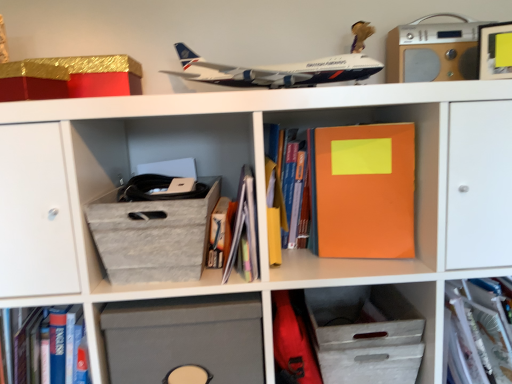
Question: From the image's perspective, relative to matte paper book at center, placed as the 2th book when sorted from left to right, is hardcover book at center, which is the 1th book from left to right, above or below?

Choices:
 (A) above
 (B) below

Answer: (B)

Question: Considering the positions of hardcover book at center, which is the 1th book from left to right, and matte paper book at center, arranged as the third book when viewed from the right, in the image, is hardcover book at center, which is the 1th book from left to right, bigger or smaller than matte paper book at center, arranged as the third book when viewed from the right,?

Choices:
 (A) small
 (B) big

Answer: (A)

Question: Which object is positioned farthest from the gray fabric shoe box at center-left?

Choices:
 (A) translucent plastic folder at center, the first book in the right-to-left sequence
 (B) matte gray storage box at lower center, which is counted as the 2th cabinet, starting from the right
 (C) wooden stereo at upper right
 (D) gold glittery cardboard box at upper left
 (E) matte paper book at center, placed as the 2th book when sorted from left to right

Answer: (C)

Question: Which is nearer to the hardcover book at center, which appears as the fourth book when viewed from the right?

Choices:
 (A) wooden stereo at upper right
 (B) matte gray storage box at lower center, which is counted as the 2th cabinet, starting from the right
 (C) gray fabric shoe box at center-left
 (D) translucent plastic folder at center, the first book in the right-to-left sequence
 (E) orange matte notebook at center

Answer: (C)